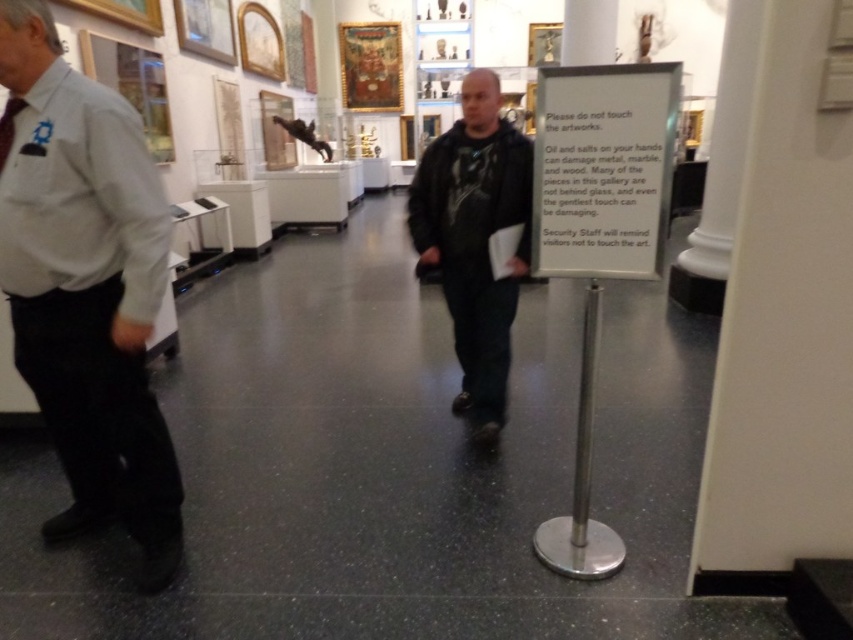
Question: Which of the following is the closest to the observer?

Choices:
 (A) (471, 228)
 (B) (114, 384)

Answer: (B)

Question: Does gray shirt at left have a larger size compared to dark green textured shirt at center?

Choices:
 (A) no
 (B) yes

Answer: (A)

Question: Does gray shirt at left have a smaller size compared to dark green textured shirt at center?

Choices:
 (A) no
 (B) yes

Answer: (B)

Question: Observing the image, what is the correct spatial positioning of gray shirt at left in reference to dark green textured shirt at center?

Choices:
 (A) below
 (B) above

Answer: (A)

Question: Which of the following is the farthest from the observer?

Choices:
 (A) coord(440,268)
 (B) coord(88,360)

Answer: (A)